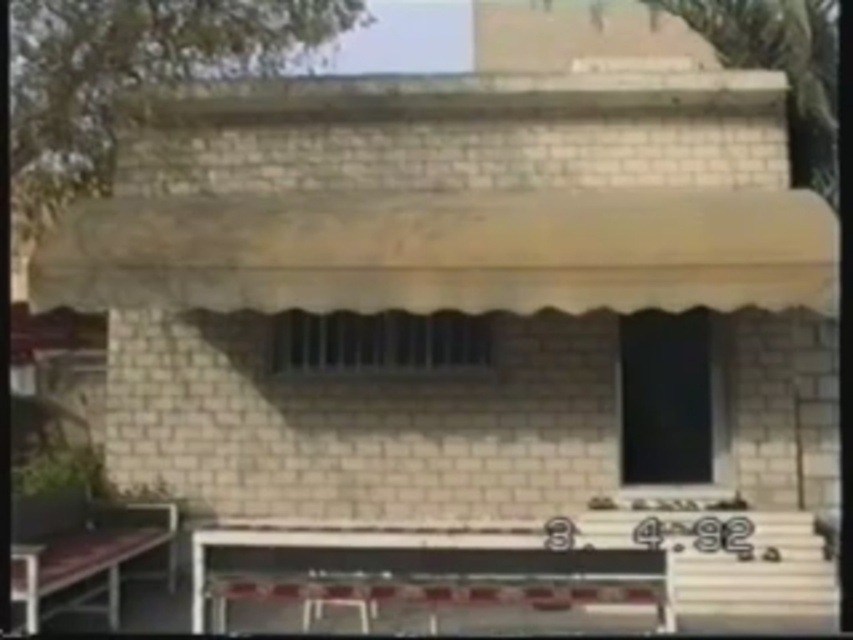
Question: Does white plastic picnic table at lower center appear under wooden park bench at lower left?

Choices:
 (A) yes
 (B) no

Answer: (B)

Question: Which object is farther from the camera taking this photo?

Choices:
 (A) wooden park bench at lower left
 (B) white plastic picnic table at lower center

Answer: (B)

Question: Which of the following is the farthest from the observer?

Choices:
 (A) wooden park bench at lower left
 (B) white plastic picnic table at lower center

Answer: (B)

Question: Can you confirm if white plastic picnic table at lower center is positioned to the right of wooden park bench at lower left?

Choices:
 (A) yes
 (B) no

Answer: (A)

Question: Where is white plastic picnic table at lower center located in relation to wooden park bench at lower left in the image?

Choices:
 (A) right
 (B) left

Answer: (A)